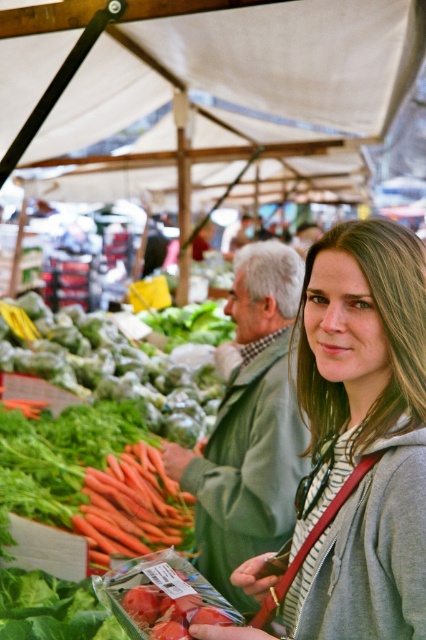
Question: From the image, what is the correct spatial relationship of white fabric canopy at upper center in relation to orange carrot at center?

Choices:
 (A) above
 (B) below

Answer: (A)

Question: Which point appears closest to the camera in this image?

Choices:
 (A) (120, 97)
 (B) (176, 536)
 (C) (376, 438)

Answer: (C)

Question: Is white fabric canopy at upper center to the right of orange smooth carrot at center from the viewer's perspective?

Choices:
 (A) no
 (B) yes

Answer: (B)

Question: Which point is closer to the camera taking this photo?

Choices:
 (A) (411, 324)
 (B) (271, 166)
 (C) (160, 515)
 (D) (175, 525)

Answer: (A)

Question: Is white fabric canopy at upper center to the left of matte gray hoodie at center from the viewer's perspective?

Choices:
 (A) yes
 (B) no

Answer: (B)

Question: Among these objects, which one is nearest to the camera?

Choices:
 (A) orange smooth carrot at center
 (B) white fabric canopy at upper center
 (C) orange carrot at center

Answer: (C)